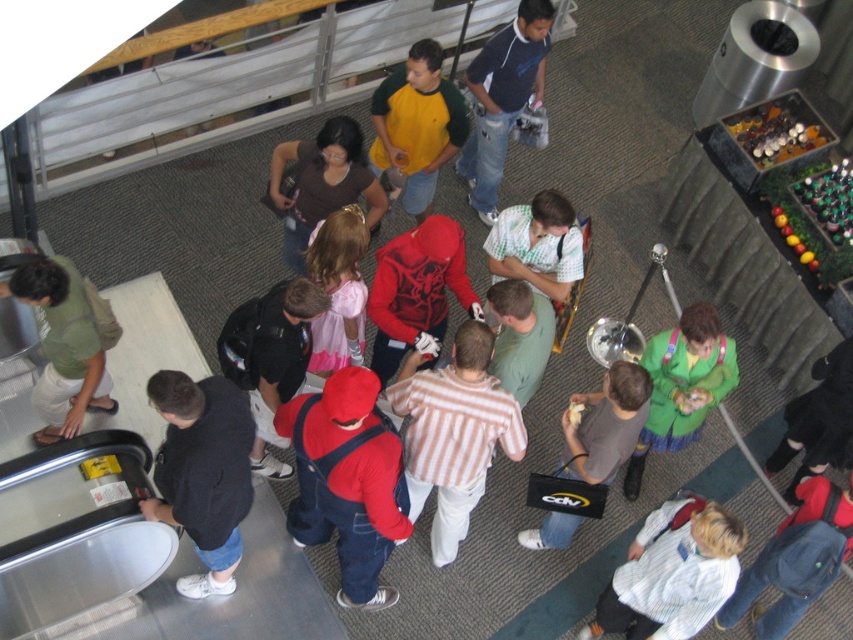
Question: Considering the relative positions of light blue sweater at center and yellow-green jersey at center in the image provided, where is light blue sweater at center located with respect to yellow-green jersey at center?

Choices:
 (A) left
 (B) right

Answer: (B)

Question: From the image, what is the correct spatial relationship of green cotton shirt at left in relation to yellow-green jersey at center?

Choices:
 (A) left
 (B) right

Answer: (A)

Question: Among these points, which one is nearest to the camera?

Choices:
 (A) (395, 88)
 (B) (57, 360)
 (C) (363, 250)
 (D) (704, 531)

Answer: (D)

Question: Is dark blue denim jeans at lower left bigger than yellow-green jersey at center?

Choices:
 (A) yes
 (B) no

Answer: (A)

Question: Which of the following is the closest to the observer?

Choices:
 (A) green cotton shirt at left
 (B) light blue sweater at center

Answer: (B)

Question: Among these points, which one is nearest to the camera?

Choices:
 (A) (433, 189)
 (B) (115, 330)
 (C) (704, 580)

Answer: (C)